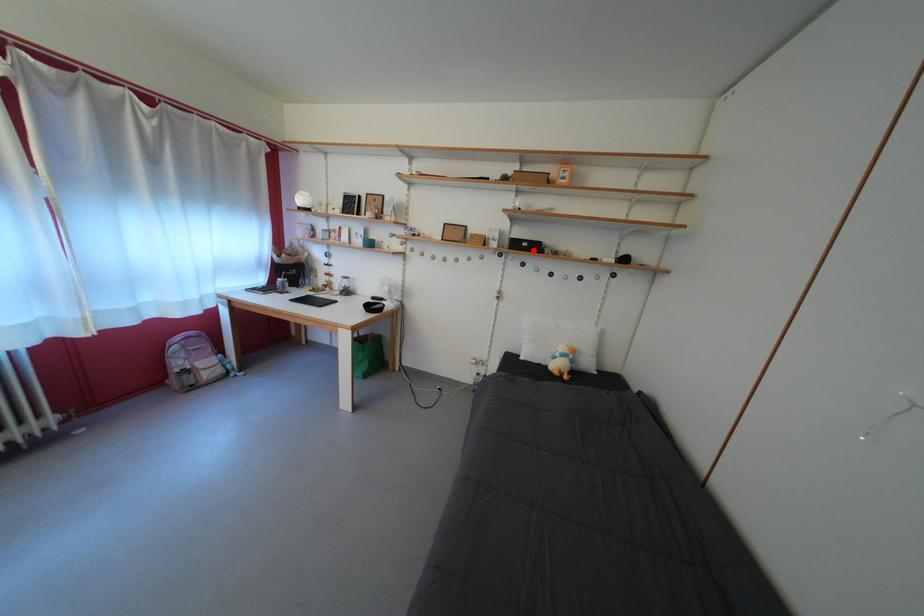
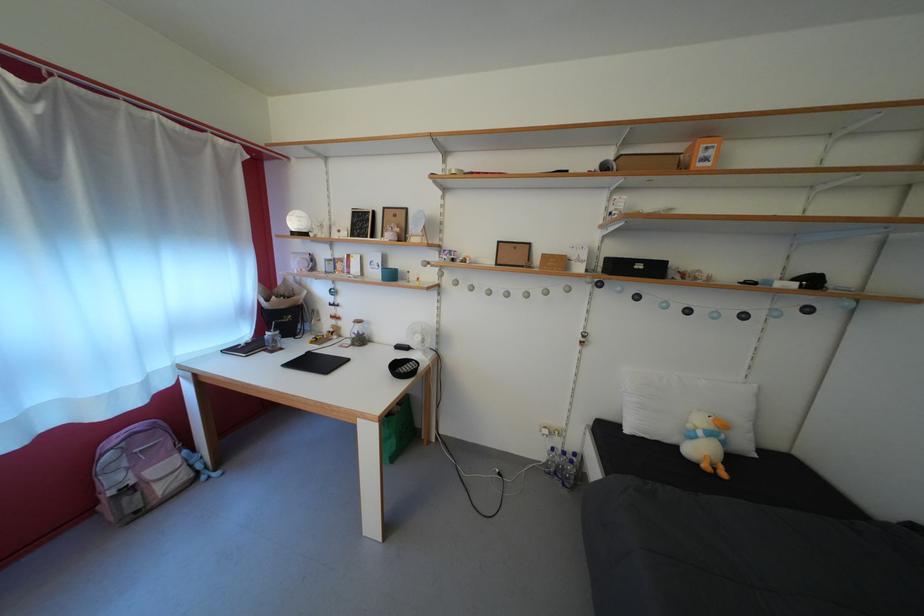
Find the pixel in the second image that matches the highlighted location in the first image.

(648, 273)